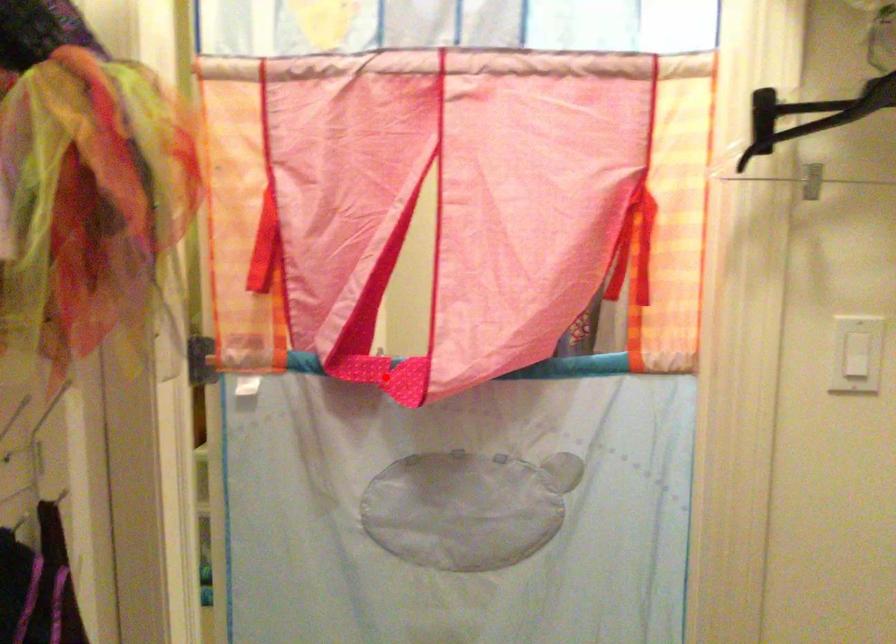
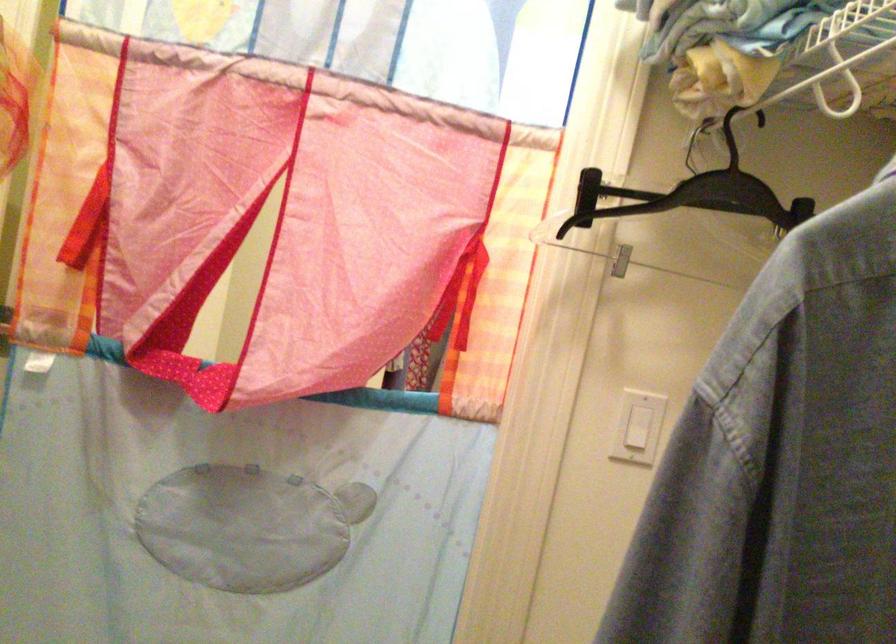
In the second image, find the point that corresponds to the highlighted location in the first image.

(188, 375)